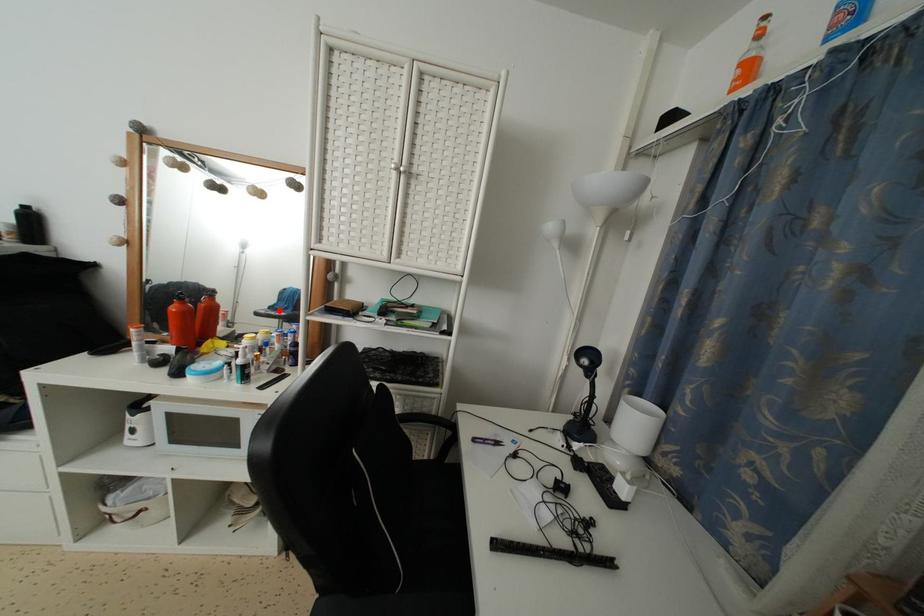
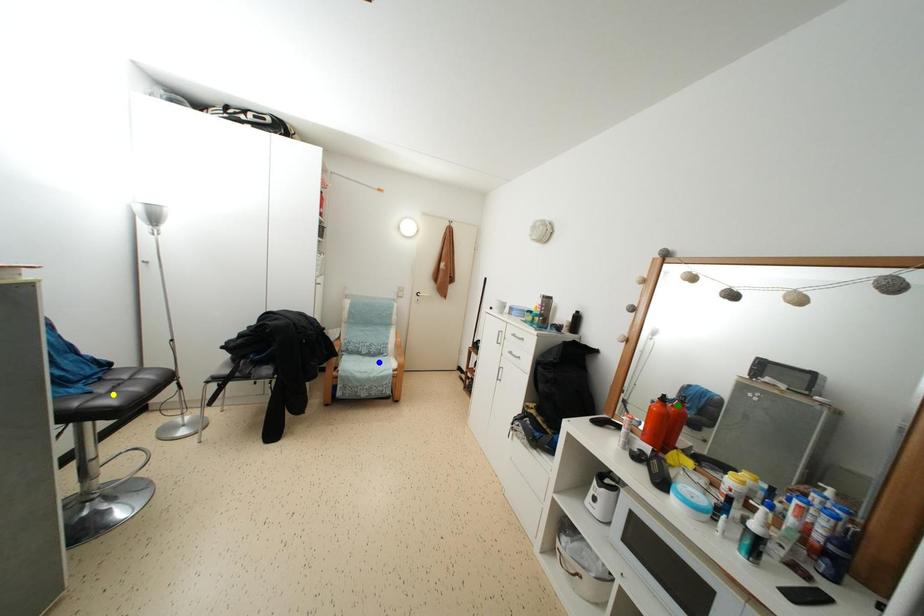
Question: I am providing you with two images of the same scene from different viewpoints. A red point is marked on the first image. You are given multiple points on the second image. Can you choose the point in image 2 that corresponds to the point in image 1?

Choices:
 (A) yellow point
 (B) blue point
 (C) green point

Answer: (C)